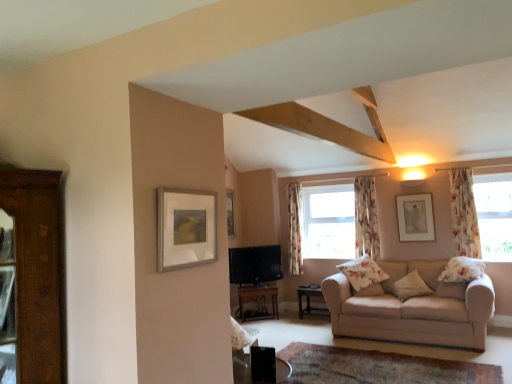
Question: Is matte silver picture frame at upper left, arranged as the second picture frame when viewed from the back, touching clear glass window at center, which appears as the 1th window when viewed from the back?

Choices:
 (A) yes
 (B) no

Answer: (B)

Question: Can you confirm if matte silver picture frame at upper left, which is counted as the first picture frame, starting from the left, is bigger than clear glass window at center, which appears as the 1th window when viewed from the back?

Choices:
 (A) no
 (B) yes

Answer: (A)

Question: Is matte silver picture frame at upper left, arranged as the second picture frame when viewed from the back, outside of clear glass window at center, which is the 1th window from left to right?

Choices:
 (A) yes
 (B) no

Answer: (A)

Question: Considering the relative sizes of matte silver picture frame at upper left, which ranks as the first picture frame in front-to-back order, and clear glass window at center, which is the 1th window from left to right, in the image provided, is matte silver picture frame at upper left, which ranks as the first picture frame in front-to-back order, wider than clear glass window at center, which is the 1th window from left to right,?

Choices:
 (A) no
 (B) yes

Answer: (A)

Question: From a real-world perspective, is matte silver picture frame at upper left, arranged as the second picture frame when viewed from the back, located beneath clear glass window at center, which appears as the 1th window when viewed from the back?

Choices:
 (A) yes
 (B) no

Answer: (B)

Question: Considering the relative sizes of matte silver picture frame at upper left, which ranks as the first picture frame in front-to-back order, and clear glass window at center, arranged as the second window when viewed from the right, in the image provided, is matte silver picture frame at upper left, which ranks as the first picture frame in front-to-back order, taller than clear glass window at center, arranged as the second window when viewed from the right,?

Choices:
 (A) no
 (B) yes

Answer: (A)

Question: Considering the relative positions of floral fabric pillow at right, which ranks as the 1th pillow in right-to-left order, and floral fabric curtain at right, the 3th curtain when ordered from left to right, in the image provided, is floral fabric pillow at right, which ranks as the 1th pillow in right-to-left order, to the left of floral fabric curtain at right, the 3th curtain when ordered from left to right, from the viewer's perspective?

Choices:
 (A) no
 (B) yes

Answer: (B)

Question: From the image's perspective, is floral fabric pillow at right, which ranks as the 1th pillow in right-to-left order, above floral fabric curtain at right, the 3th curtain when ordered from left to right?

Choices:
 (A) no
 (B) yes

Answer: (A)

Question: From the image's perspective, is floral fabric pillow at right, which ranks as the 1th pillow in right-to-left order, located beneath floral fabric curtain at right, the 1th curtain when ordered from right to left?

Choices:
 (A) no
 (B) yes

Answer: (B)

Question: Is floral fabric pillow at right, which ranks as the 1th pillow in right-to-left order, taller than floral fabric curtain at right, the 3th curtain when ordered from left to right?

Choices:
 (A) no
 (B) yes

Answer: (A)

Question: Could you tell me if floral fabric pillow at right, which is counted as the 3th pillow, starting from the left, is facing floral fabric curtain at right, the 1th curtain in the front-to-back sequence?

Choices:
 (A) yes
 (B) no

Answer: (B)

Question: Can floral fabric curtain at right, the 3th curtain when ordered from left to right, be found inside floral fabric pillow at right, which is counted as the 3th pillow, starting from the left?

Choices:
 (A) no
 (B) yes

Answer: (A)

Question: Is floral fabric curtain at center, marked as the first curtain in a left-to-right arrangement, shorter than transparent floral curtains at upper right, the 1th window from the right?

Choices:
 (A) yes
 (B) no

Answer: (B)